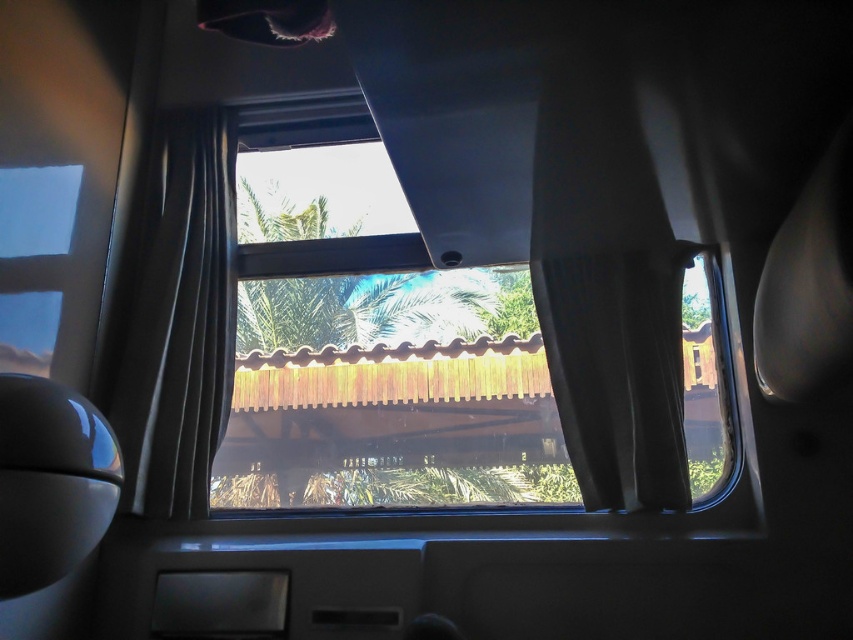
I want to click on transparent glass window at center, so click(376, 355).

Can you confirm if transparent glass window at center is thinner than black velvet curtain at right?

In fact, transparent glass window at center might be wider than black velvet curtain at right.

Is point (415, 253) in front of point (640, 316)?

No.

At what (x,y) coordinates should I click in order to perform the action: click on transparent glass window at center. Please return your answer as a coordinate pair (x, y). Looking at the image, I should click on (376, 355).

Can you confirm if transparent glass window at center is positioned above black fabric curtain at center?

No, transparent glass window at center is not above black fabric curtain at center.

Is transparent glass window at center to the right of black fabric curtain at center from the viewer's perspective?

Yes, transparent glass window at center is to the right of black fabric curtain at center.

Who is more distant from viewer, (387, 317) or (215, 124)?

Point (215, 124)

At what (x,y) coordinates should I click in order to perform the action: click on transparent glass window at center. Please return your answer as a coordinate pair (x, y). The width and height of the screenshot is (853, 640). Looking at the image, I should click on pos(376,355).

You are a GUI agent. You are given a task and a screenshot of the screen. Output one action in this format:
    pyautogui.click(x=<x>, y=<y>)
    Task: Click on the transparent glass window at center
    This screenshot has height=640, width=853.
    Given the screenshot: What is the action you would take?
    pyautogui.click(x=376, y=355)

Does transparent glass window at center have a larger size compared to green leafy palm tree at center?

Correct, transparent glass window at center is larger in size than green leafy palm tree at center.

Is point (328, 308) farther from viewer compared to point (239, 189)?

No, (328, 308) is closer to viewer.

The height and width of the screenshot is (640, 853). I want to click on transparent glass window at center, so click(x=376, y=355).